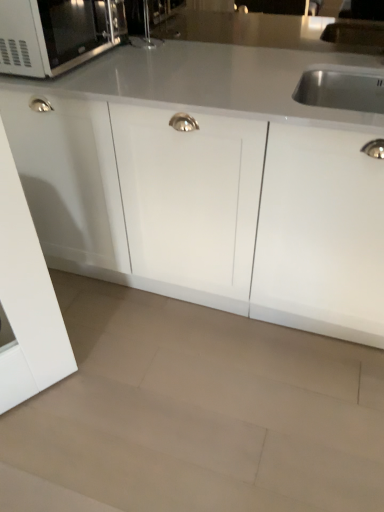
Question: From the image's perspective, is matte black microwave at upper left located above white glossy cabinet at center?

Choices:
 (A) yes
 (B) no

Answer: (A)

Question: Does matte black microwave at upper left have a lesser width compared to white glossy cabinet at center?

Choices:
 (A) no
 (B) yes

Answer: (B)

Question: Is matte black microwave at upper left to the right of white glossy cabinet at center from the viewer's perspective?

Choices:
 (A) yes
 (B) no

Answer: (B)

Question: Is matte black microwave at upper left further to camera compared to white glossy cabinet at center?

Choices:
 (A) yes
 (B) no

Answer: (A)

Question: From a real-world perspective, is matte black microwave at upper left located beneath white glossy cabinet at center?

Choices:
 (A) yes
 (B) no

Answer: (B)

Question: From their relative heights in the image, would you say beige polished granite at lower center is taller or shorter than matte black microwave at upper left?

Choices:
 (A) short
 (B) tall

Answer: (A)

Question: Is beige polished granite at lower center wider or thinner than matte black microwave at upper left?

Choices:
 (A) wide
 (B) thin

Answer: (A)

Question: From the image's perspective, is beige polished granite at lower center positioned above or below matte black microwave at upper left?

Choices:
 (A) above
 (B) below

Answer: (B)

Question: From a real-world perspective, relative to matte black microwave at upper left, is beige polished granite at lower center vertically above or below?

Choices:
 (A) above
 (B) below

Answer: (B)

Question: Does point (261, 287) appear closer or farther from the camera than point (66, 27)?

Choices:
 (A) farther
 (B) closer

Answer: (A)

Question: From the image's perspective, is white glossy cabinet at center located above or below matte black microwave at upper left?

Choices:
 (A) above
 (B) below

Answer: (B)

Question: Is white glossy cabinet at center inside or outside of matte black microwave at upper left?

Choices:
 (A) inside
 (B) outside

Answer: (B)

Question: Relative to matte black microwave at upper left, is white glossy cabinet at center in front or behind?

Choices:
 (A) behind
 (B) front

Answer: (B)

Question: Is beige polished granite at lower center wider or thinner than white glossy cabinet at center?

Choices:
 (A) thin
 (B) wide

Answer: (B)

Question: In terms of size, does beige polished granite at lower center appear bigger or smaller than white glossy cabinet at center?

Choices:
 (A) small
 (B) big

Answer: (A)